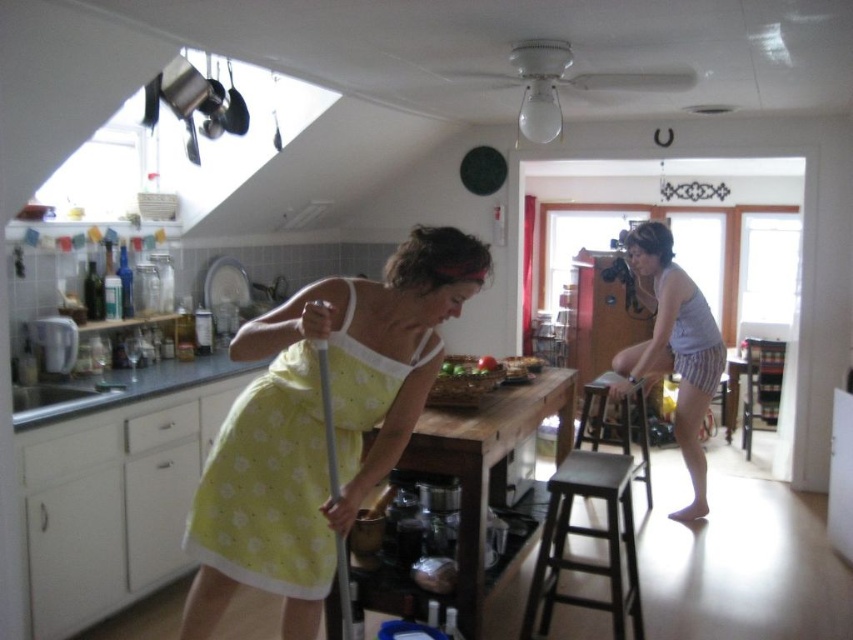
You are a person who is 1.6 meters tall. You need to place a small vase on top of the dark brown wooden stool at lower center. However, you also want to ensure that the gray striped apron at right remains visible from your current viewpoint. Can you do both tasks without moving either object?

The dark brown wooden stool at lower center is taller than the gray striped apron at right. Since the stool is taller, placing the vase on top would still allow the apron to remain visible as it is shorter. Therefore, yes, you can place the vase on the stool and keep the gray striped apron at right visible.

Consider the image. You are a fashion designer observing the woman in the kitchen. You need to determine the spatial relationship between her clothing items. Which clothing item is positioned lower on her body, the gray cotton tank top at center or the gray striped apron at right?

The gray cotton tank top at center is positioned lower on her body than the gray striped apron at right because the description states that the gray cotton tank top at center is below the gray striped apron at right.

You are a cleaning robot with a width of 2 feet. You are in the kitchen and need to move from the dark brown wooden stool at lower center to the gray striped apron at right. Can you pass through the space between them?

The dark brown wooden stool at lower center and gray striped apron at right are 4.06 feet apart, so the robot can pass through the space between them since it is wider than the robot.